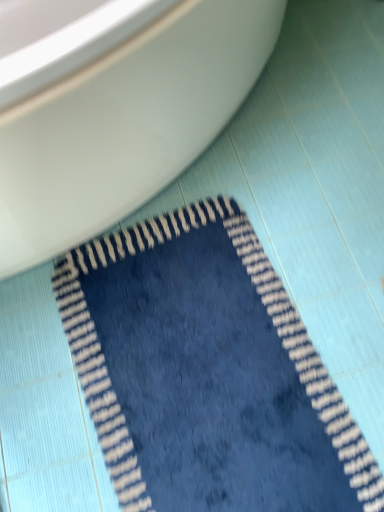
Identify the location of vacant space in between white glossy toilet at upper left and navy blue plush rug at lower center. The height and width of the screenshot is (512, 384). (286, 308).